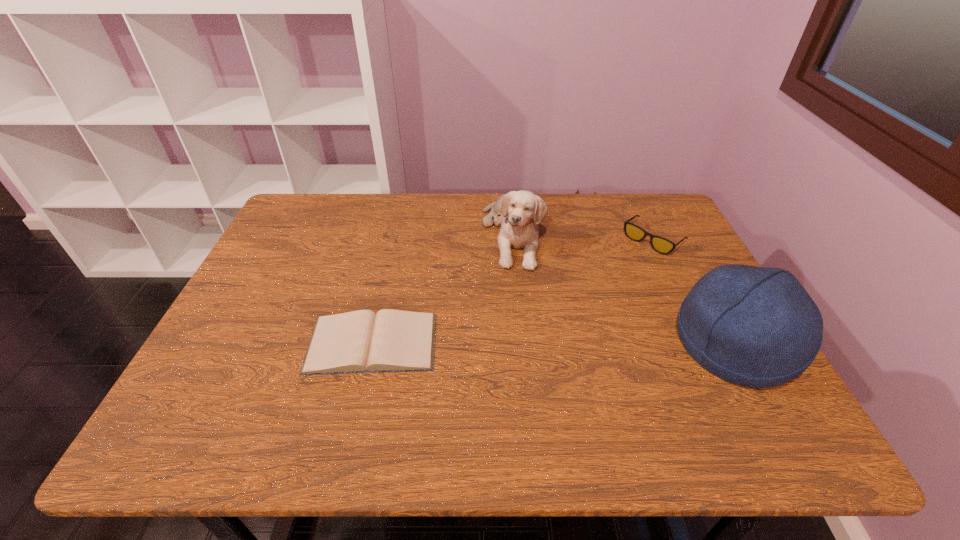
Locate an element on the screen. This screenshot has height=540, width=960. free space located on the front-facing side of the third shortest object is located at coordinates (562, 395).

The height and width of the screenshot is (540, 960). I want to click on blank area located on the front-facing side of the third tallest object, so click(612, 276).

What are the coordinates of `blank space located on the front-facing side of the third tallest object` in the screenshot? It's located at (605, 281).

Identify the location of free space located 0.150m on the front-facing side of the third tallest object. The height and width of the screenshot is (540, 960). (610, 278).

Locate an element on the screen. The image size is (960, 540). puppy at the far edge is located at coordinates (520, 212).

At what (x,y) coordinates should I click in order to perform the action: click on sunglasses that is at the far edge. Please return your answer as a coordinate pair (x, y). Looking at the image, I should click on (661, 245).

Identify the location of Bible present at the near edge. The height and width of the screenshot is (540, 960). (362, 341).

You are a GUI agent. You are given a task and a screenshot of the screen. Output one action in this format:
    pyautogui.click(x=<x>, y=<y>)
    Task: Click on the skullcap that is positioned at the near edge
    Image resolution: width=960 pixels, height=540 pixels.
    Given the screenshot: What is the action you would take?
    pyautogui.click(x=757, y=327)

You are a GUI agent. You are given a task and a screenshot of the screen. Output one action in this format:
    pyautogui.click(x=<x>, y=<y>)
    Task: Click on the skullcap that is at the right edge
    The width and height of the screenshot is (960, 540).
    Given the screenshot: What is the action you would take?
    pyautogui.click(x=757, y=327)

You are a GUI agent. You are given a task and a screenshot of the screen. Output one action in this format:
    pyautogui.click(x=<x>, y=<y>)
    Task: Click on the sunglasses that is positioned at the right edge
    The image size is (960, 540).
    Given the screenshot: What is the action you would take?
    pyautogui.click(x=661, y=245)